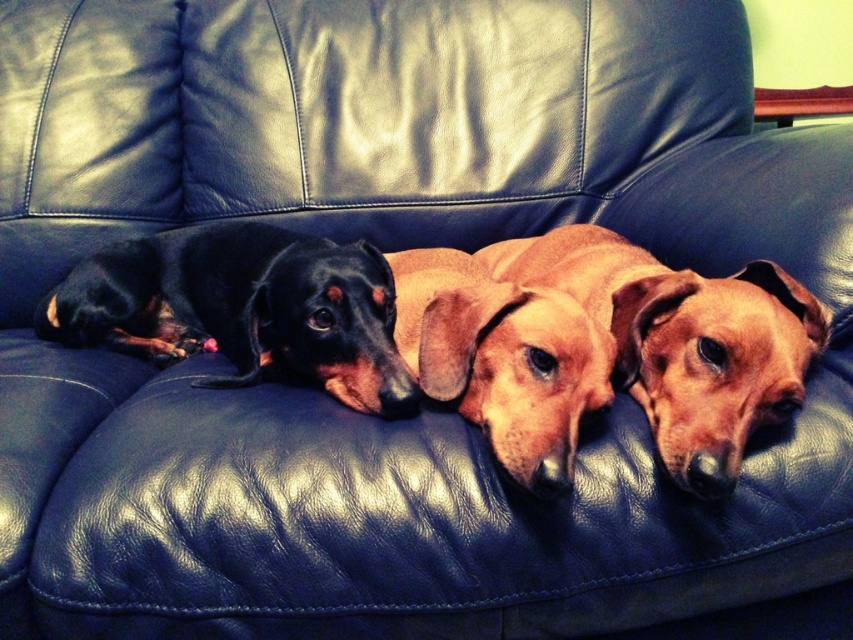
Question: Does brown matte dog at center appear over black smooth dachshund at left?

Choices:
 (A) yes
 (B) no

Answer: (B)

Question: Among these objects, which one is farthest from the camera?

Choices:
 (A) black smooth dachshund at left
 (B) brown matte dog at center

Answer: (A)

Question: Where is brown matte dog at center located in relation to black smooth dachshund at left in the image?

Choices:
 (A) below
 (B) above

Answer: (A)

Question: Can you confirm if brown matte dog at center is bigger than black smooth dachshund at left?

Choices:
 (A) no
 (B) yes

Answer: (B)